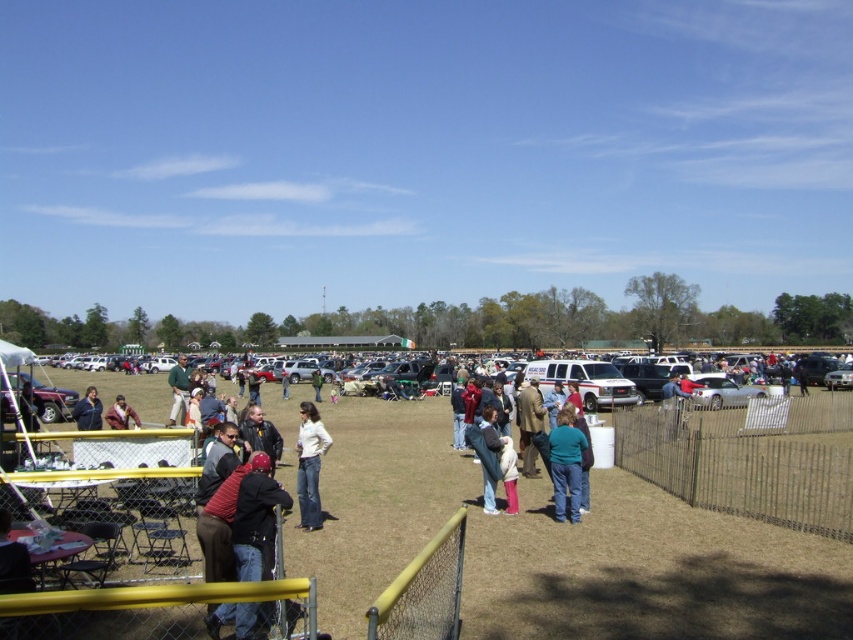
Question: Considering the relative positions of matte black jacket at center and maroon fabric jacket at lower left in the image provided, where is matte black jacket at center located with respect to maroon fabric jacket at lower left?

Choices:
 (A) right
 (B) left

Answer: (B)

Question: Considering the relative positions of teal fabric shirt at center and maroon fabric jacket at lower left in the image provided, where is teal fabric shirt at center located with respect to maroon fabric jacket at lower left?

Choices:
 (A) below
 (B) above

Answer: (B)

Question: Which point appears farthest from the camera in this image?

Choices:
 (A) (302, 502)
 (B) (187, 387)
 (C) (579, 474)
 (D) (85, 404)

Answer: (B)

Question: Among these points, which one is farthest from the camera?

Choices:
 (A) (573, 500)
 (B) (88, 400)
 (C) (242, 508)
 (D) (757, 406)

Answer: (D)

Question: Can you confirm if white matte shirt at center is positioned below matte black jacket at center?

Choices:
 (A) no
 (B) yes

Answer: (A)

Question: Which point is closer to the camera?

Choices:
 (A) (300, 506)
 (B) (234, 545)
 (C) (126, 422)
 (D) (178, 376)

Answer: (B)